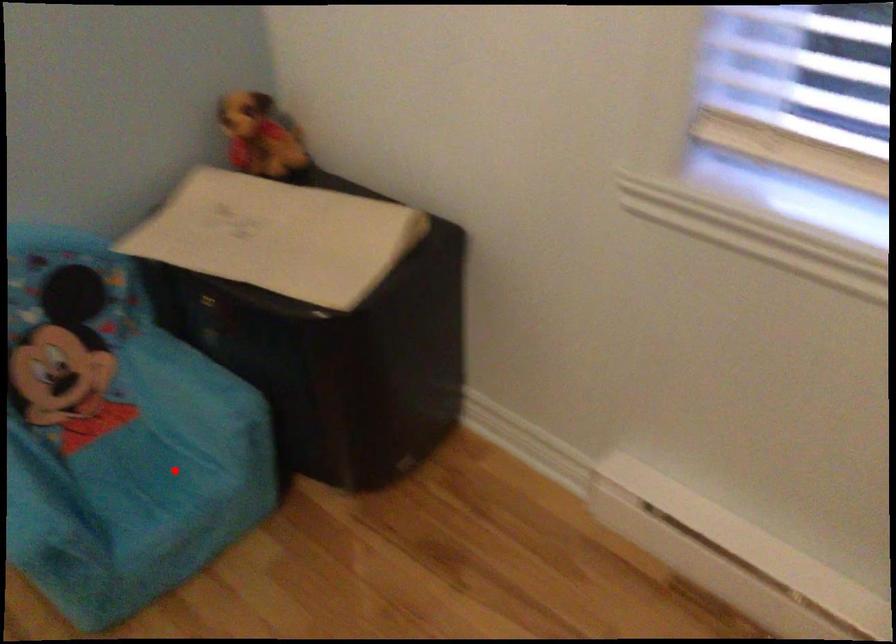
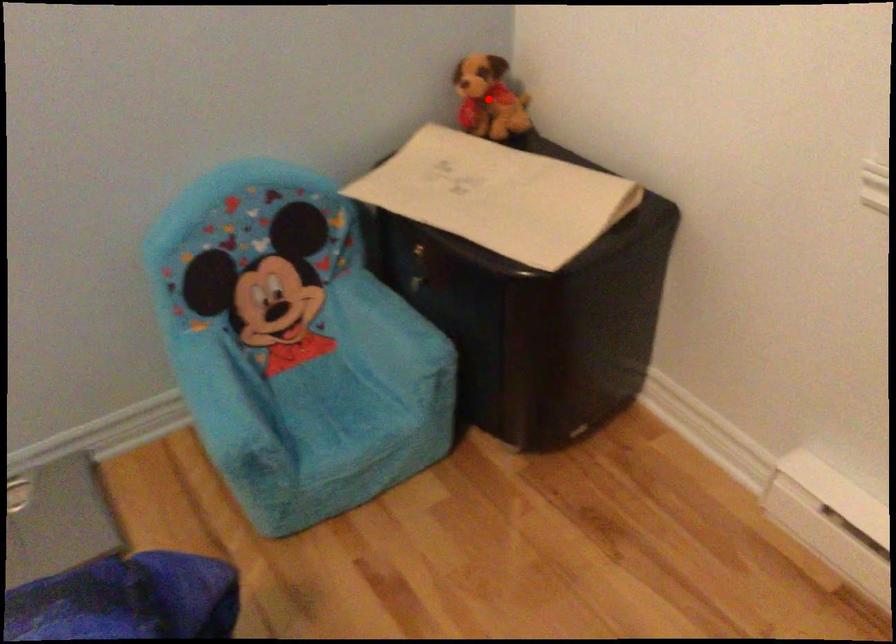
I am providing you with two images of the same scene from different viewpoints. A red point is marked on the first image and another point is marked on the second image. Does the point marked in image1 correspond to the same location as the one in image2?

No